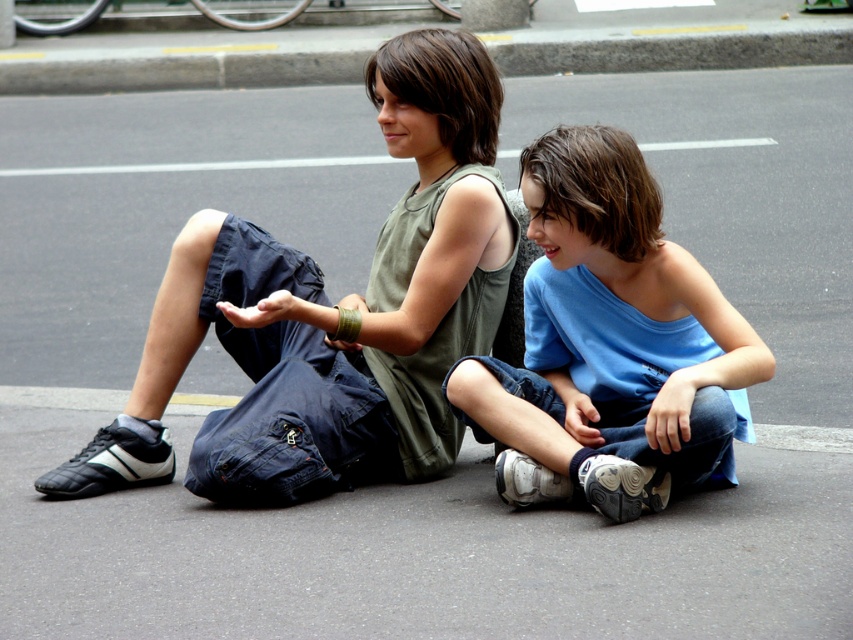
Question: Estimate the real-world distances between objects in this image. Which object is closer to the matte green tank top at center?

Choices:
 (A) blue cotton shirt at center
 (B) gray concrete curb at upper center

Answer: (A)

Question: Which object is the farthest from the blue cotton shirt at center?

Choices:
 (A) matte green tank top at center
 (B) gray concrete curb at upper center

Answer: (B)

Question: Does matte green tank top at center appear on the right side of blue cotton shirt at center?

Choices:
 (A) no
 (B) yes

Answer: (A)

Question: Which point is closer to the camera?

Choices:
 (A) blue cotton shirt at center
 (B) matte green tank top at center
 (C) gray concrete curb at upper center

Answer: (A)

Question: Can you confirm if blue cotton shirt at center is positioned above gray concrete curb at upper center?

Choices:
 (A) yes
 (B) no

Answer: (B)

Question: Is matte green tank top at center thinner than gray concrete curb at upper center?

Choices:
 (A) no
 (B) yes

Answer: (B)